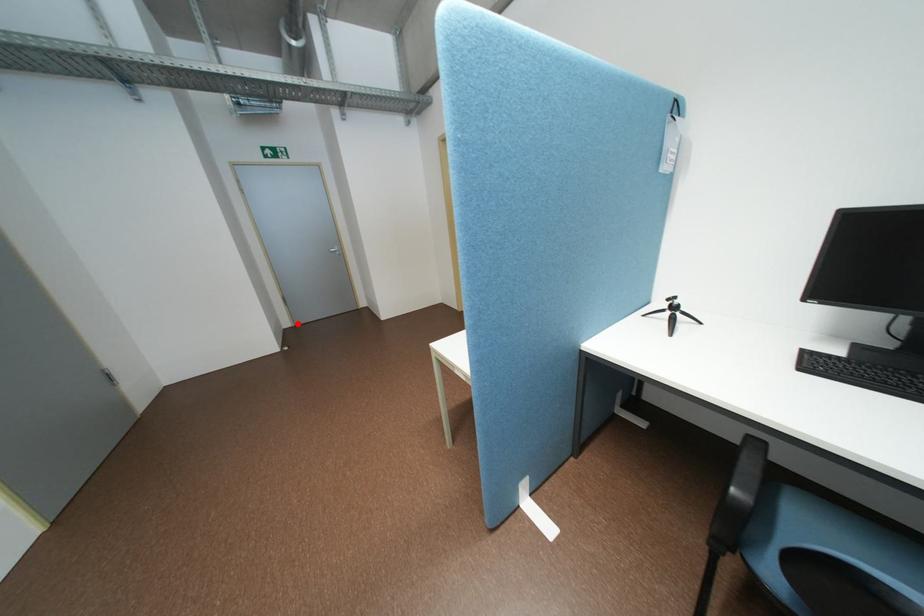
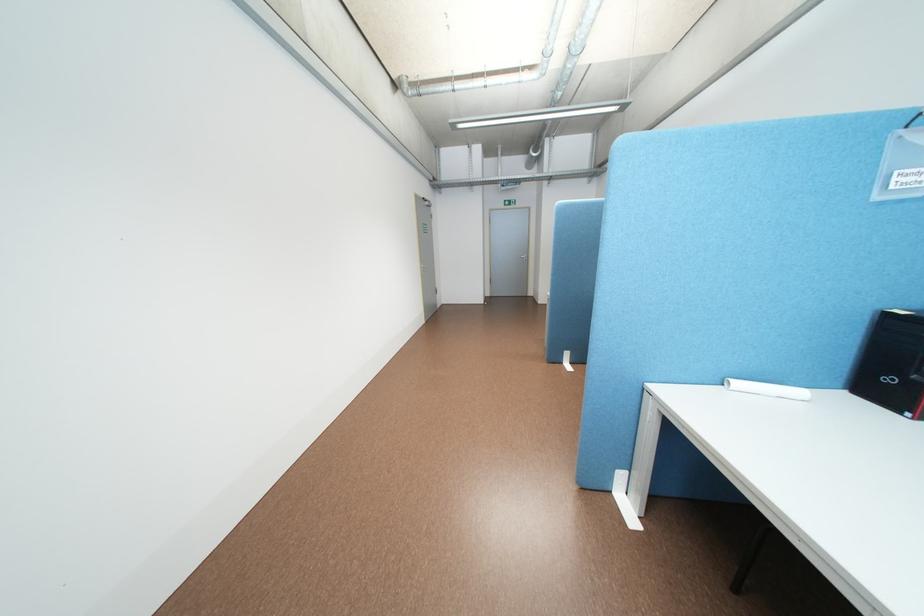
Question: I am providing you with two images of the same scene from different viewpoints. Given a red point in image1, look at the same physical point in image2. Is it:

Choices:
 (A) Closer to the viewpoint
 (B) Farther from the viewpoint

Answer: (B)